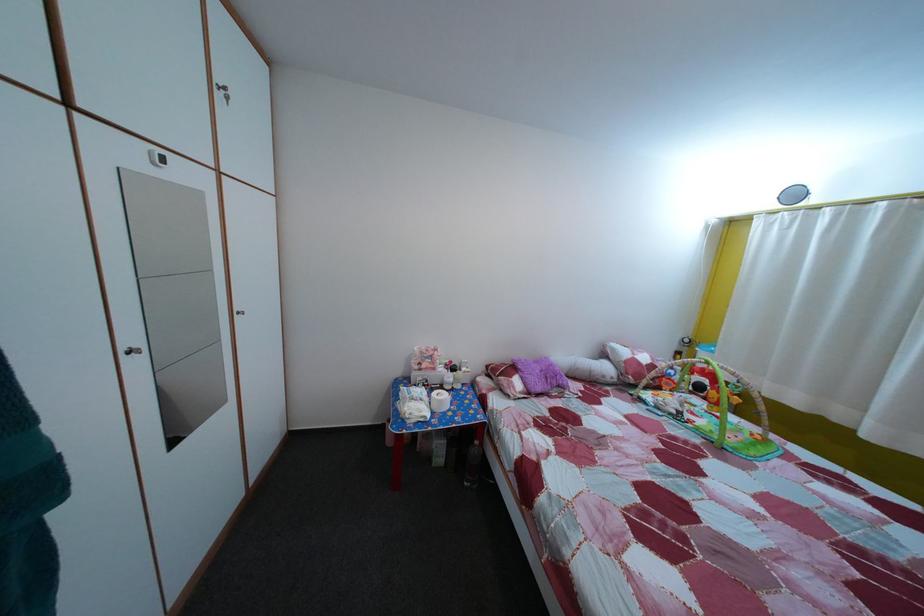
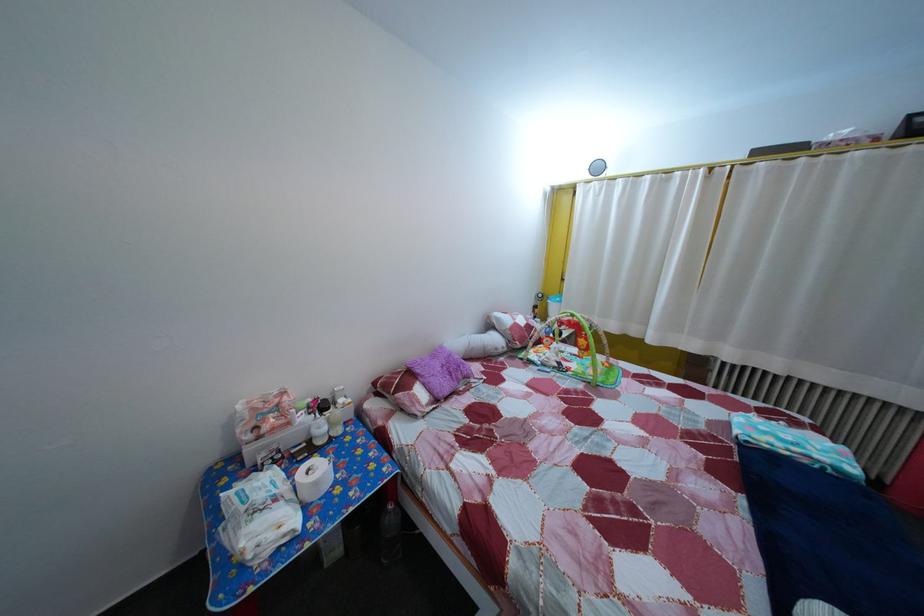
Locate, in the second image, the point that corresponds to (x=451, y=377) in the first image.

(311, 427)